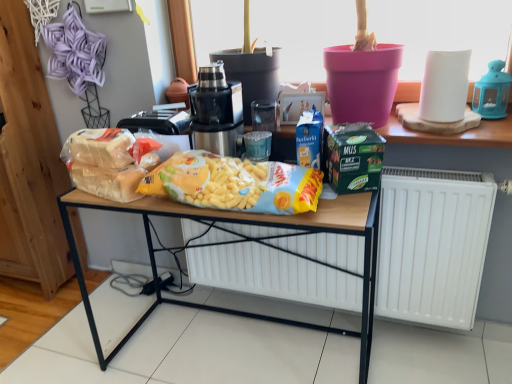
The height and width of the screenshot is (384, 512). Describe the element at coordinates (352, 157) in the screenshot. I see `green matte lunch box at center` at that location.

What do you see at coordinates (234, 184) in the screenshot?
I see `yellow matte snack packet at center, which is the 2th waste from left to right` at bounding box center [234, 184].

What do you see at coordinates (247, 241) in the screenshot?
I see `wooden table at center` at bounding box center [247, 241].

Image resolution: width=512 pixels, height=384 pixels. Describe the element at coordinates (216, 111) in the screenshot. I see `black metallic juicer at center` at that location.

What do you see at coordinates (433, 244) in the screenshot? This screenshot has height=384, width=512. I see `white matte radiator at lower center` at bounding box center [433, 244].

Image resolution: width=512 pixels, height=384 pixels. What are the coordinates of `white matte radiator at lower center` in the screenshot? It's located at (433, 244).

What is the approximate width of wooden shelf at upper center?

wooden shelf at upper center is 15.37 inches wide.

Where is `blue plastic lantern at upper right`? The height and width of the screenshot is (384, 512). blue plastic lantern at upper right is located at coordinates (492, 92).

Considering the relative positions of white matte radiator at lower center and translucent plastic bag at center, the 2th waste viewed from the right, in the image provided, is white matte radiator at lower center to the left of translucent plastic bag at center, the 2th waste viewed from the right, from the viewer's perspective?

No, white matte radiator at lower center is not to the left of translucent plastic bag at center, the 2th waste viewed from the right.

Choose the correct answer: Is white matte radiator at lower center inside translucent plastic bag at center, the first waste from the left, or outside it?

white matte radiator at lower center cannot be found inside translucent plastic bag at center, the first waste from the left.

In terms of width, does white matte radiator at lower center look wider or thinner when compared to translucent plastic bag at center, the 2th waste viewed from the right?

In the image, white matte radiator at lower center appears to be more narrow than translucent plastic bag at center, the 2th waste viewed from the right.

Is white matte radiator at lower center behind translucent plastic bag at center, the 2th waste viewed from the right?

Yes, white matte radiator at lower center is behind translucent plastic bag at center, the 2th waste viewed from the right.

How different are the orientations of wooden table at center and green matte lunch box at center in degrees?

wooden table at center and green matte lunch box at center are facing 11.5 degrees away from each other.

Can you confirm if wooden table at center is shorter than green matte lunch box at center?

Incorrect, the height of wooden table at center does not fall short of that of green matte lunch box at center.

Is wooden table at center thinner than green matte lunch box at center?

No, wooden table at center is not thinner than green matte lunch box at center.

Is wooden table at center not near green matte lunch box at center?

Actually, wooden table at center and green matte lunch box at center are a little close together.

In the image, is green matte lunch box at center on the left side or the right side of yellow matte snack packet at center, which is the 2th waste from left to right?

Clearly, green matte lunch box at center is on the right of yellow matte snack packet at center, which is the 2th waste from left to right, in the image.

Is the position of green matte lunch box at center less distant than that of yellow matte snack packet at center, the 1th waste when ordered from right to left?

No, the depth of green matte lunch box at center is greater than that of yellow matte snack packet at center, the 1th waste when ordered from right to left.

Between green matte lunch box at center and yellow matte snack packet at center, the 1th waste when ordered from right to left, which one has larger width?

yellow matte snack packet at center, the 1th waste when ordered from right to left.

Considering the relative sizes of green matte lunch box at center and yellow matte snack packet at center, which is the 2th waste from left to right, in the image provided, is green matte lunch box at center shorter than yellow matte snack packet at center, which is the 2th waste from left to right,?

No, green matte lunch box at center is not shorter than yellow matte snack packet at center, which is the 2th waste from left to right.

The image size is (512, 384). I want to click on window sill that appears behind the green matte lunch box at center, so click(453, 134).

Which is behind, green matte lunch box at center or wooden shelf at upper center?

wooden shelf at upper center is behind.

From a real-world perspective, is green matte lunch box at center above or below wooden shelf at upper center?

In terms of real-world spatial position, green matte lunch box at center is above wooden shelf at upper center.

Can you tell me how much white matte radiator at lower center and wooden table at center differ in facing direction?

They differ by 1.12 degrees in their facing directions.

Which of these two, white matte radiator at lower center or wooden table at center, is thinner?

white matte radiator at lower center is thinner.

Could wooden table at center be considered to be inside white matte radiator at lower center?

No, wooden table at center is not surrounded by white matte radiator at lower center.

In the image, is white matte radiator at lower center positioned in front of or behind wooden table at center?

In the image, white matte radiator at lower center appears behind wooden table at center.

Is wooden shelf at upper center oriented away from green matte lunch box at center?

No, wooden shelf at upper center is not facing away from green matte lunch box at center.

Is wooden shelf at upper center not inside green matte lunch box at center?

wooden shelf at upper center is positioned outside green matte lunch box at center.

Based on the photo, is wooden shelf at upper center touching green matte lunch box at center?

No, wooden shelf at upper center is not beside green matte lunch box at center.

Locate an element on the screen. lunch box on the left side of wooden shelf at upper center is located at coordinates (352, 157).

Which of these two, translucent plastic bag at center, the 2th waste viewed from the right, or black metallic juicer at center, stands shorter?

translucent plastic bag at center, the 2th waste viewed from the right, is shorter.

From a real-world perspective, is translucent plastic bag at center, the first waste from the left, under black metallic juicer at center?

Yes, from a real-world perspective, translucent plastic bag at center, the first waste from the left, is under black metallic juicer at center.

Are translucent plastic bag at center, the 2th waste viewed from the right, and black metallic juicer at center beside each other?

No, translucent plastic bag at center, the 2th waste viewed from the right, is not touching black metallic juicer at center.

Is black metallic juicer at center located within translucent plastic bag at center, the first waste from the left?

No, black metallic juicer at center is not a part of translucent plastic bag at center, the first waste from the left.

In order to click on radiator on the right side of translucent plastic bag at center, the 2th waste viewed from the right in this screenshot , I will do `click(433, 244)`.

In the image, there is a green matte lunch box at center. Where is `desk below it (from a real-world perspective)`? desk below it (from a real-world perspective) is located at coordinates (247, 241).

Based on their spatial positions, is blue plastic lantern at upper right or wooden table at center further from white matte radiator at lower center?

Based on the image, blue plastic lantern at upper right appears to be further to white matte radiator at lower center.

Based on their spatial positions, is white matte radiator at lower center or black metallic juicer at center closer to green matte lunch box at center?

black metallic juicer at center is closer to green matte lunch box at center.

Which object lies further to the anchor point white matte radiator at lower center, wooden table at center or yellow matte snack packet at center, the 1th waste when ordered from right to left?

Based on the image, yellow matte snack packet at center, the 1th waste when ordered from right to left, appears to be further to white matte radiator at lower center.

Considering their positions, is blue plastic lantern at upper right positioned further to black metallic juicer at center than wooden table at center?

blue plastic lantern at upper right.

Considering their positions, is green matte lunch box at center positioned closer to wooden shelf at upper center than wooden table at center?

green matte lunch box at center lies closer to wooden shelf at upper center than the other object.

Estimate the real-world distances between objects in this image. Which object is closer to translucent plastic bag at center, the first waste from the left, wooden shelf at upper center or black metallic juicer at center?

black metallic juicer at center.

Which object lies further to the anchor point black metallic juicer at center, wooden table at center or translucent plastic bag at center, the first waste from the left?

wooden table at center is further to black metallic juicer at center.

When comparing their distances from yellow matte snack packet at center, which is the 2th waste from left to right, does wooden table at center or wooden shelf at upper center seem further?

wooden shelf at upper center is further to yellow matte snack packet at center, which is the 2th waste from left to right.

The width and height of the screenshot is (512, 384). I want to click on waste between translucent plastic bag at center, the first waste from the left, and green matte lunch box at center from left to right, so click(234, 184).

Find the location of a particular element. This screenshot has height=384, width=512. desk between translucent plastic bag at center, the first waste from the left, and white matte radiator at lower center, in the horizontal direction is located at coordinates (247, 241).

Locate an element on the screen. The width and height of the screenshot is (512, 384). waste between wooden table at center and blue plastic lantern at upper right is located at coordinates (234, 184).

Identify the location of radiator between black metallic juicer at center and wooden table at center in the vertical direction. (433, 244).